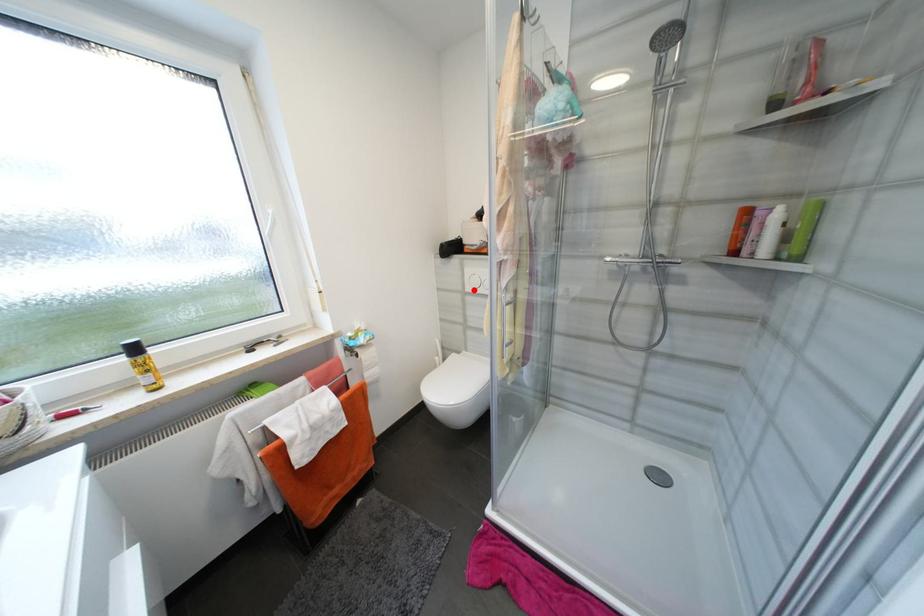
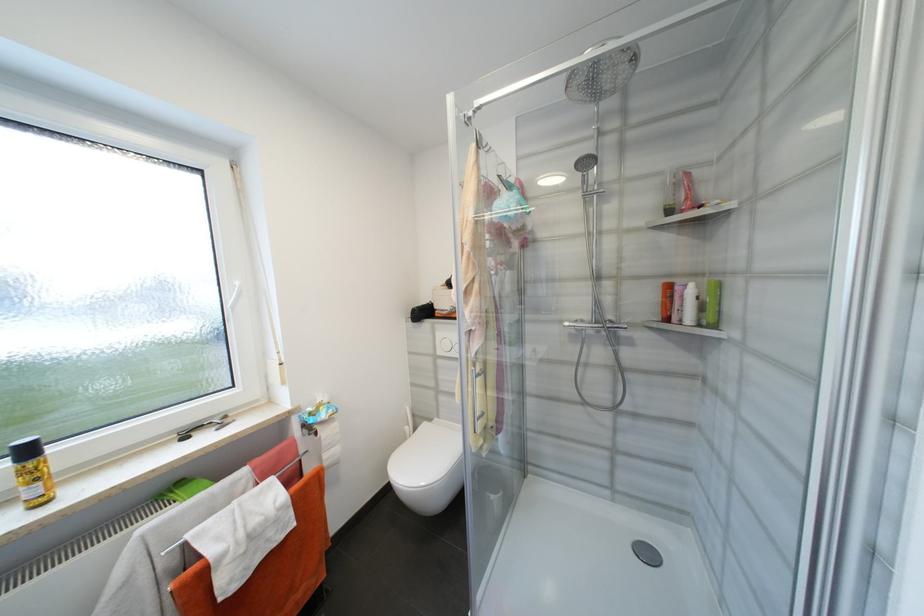
In the second image, find the point that corresponds to the highlighted location in the first image.

(445, 353)